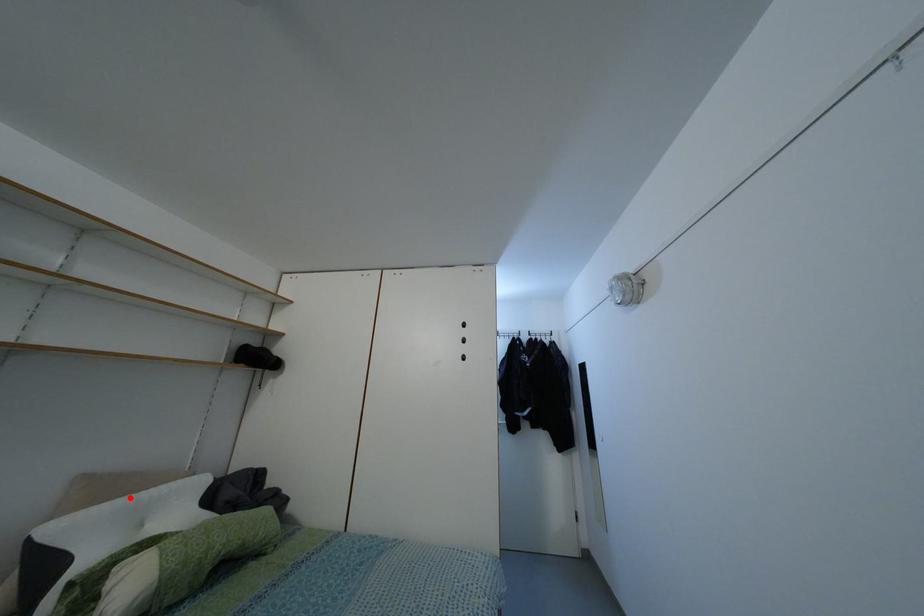
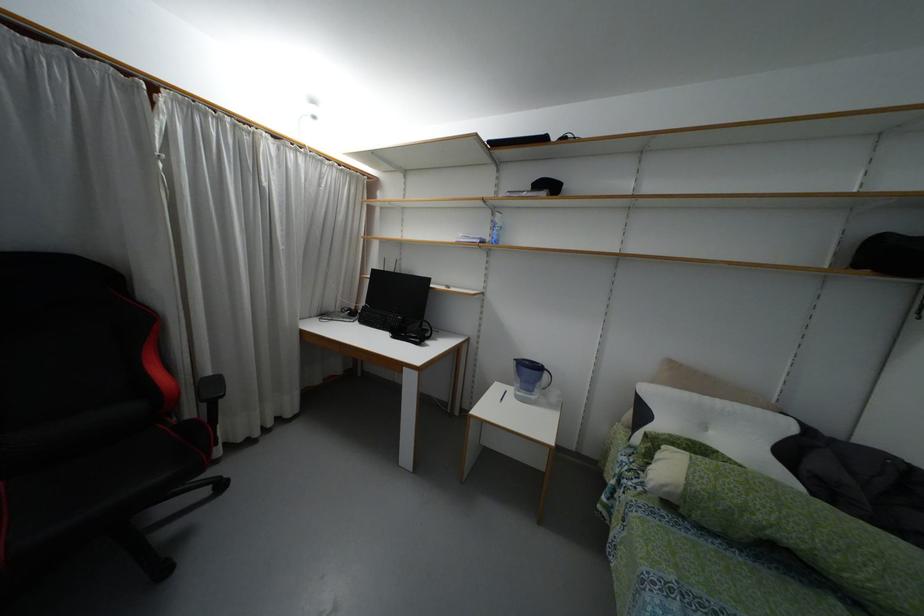
Question: I am providing you with two images of the same scene from different viewpoints. Image1 has a red point marked. In image2, the corresponding 3D location appears at what relative position? Reply with the corresponding letter.

Choices:
 (A) Closer
 (B) Farther

Answer: (B)